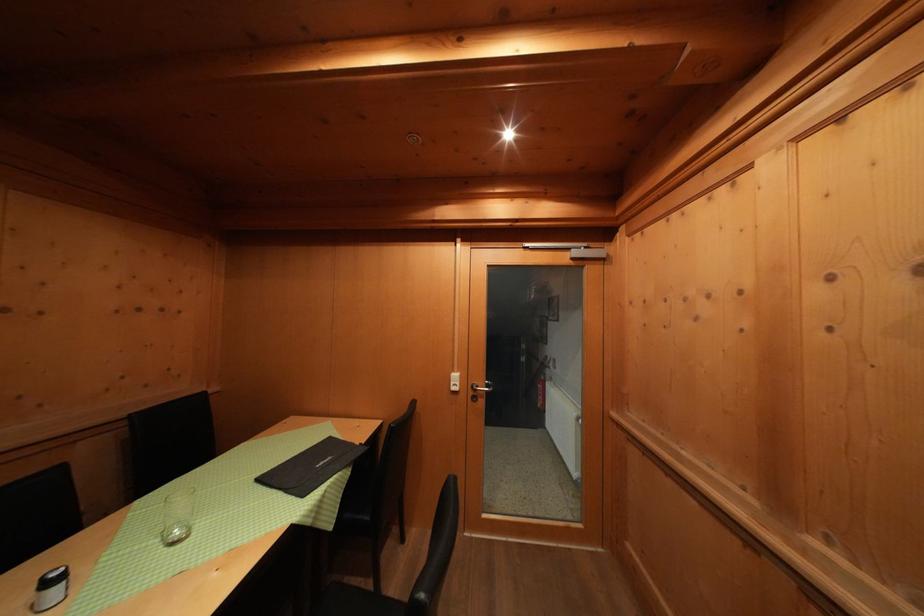
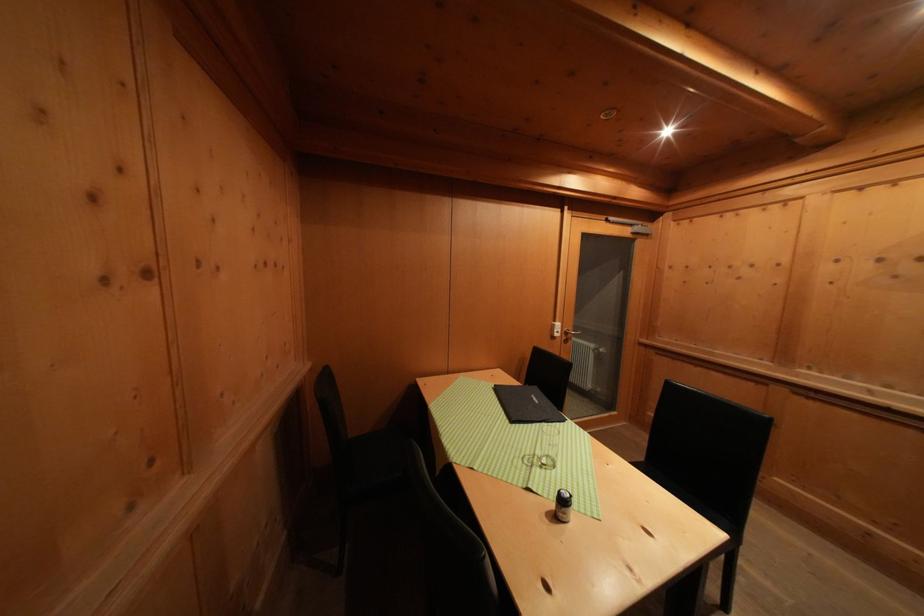
The point at [281,496] is marked in the first image. Where is the corresponding point in the second image?

(543, 429)